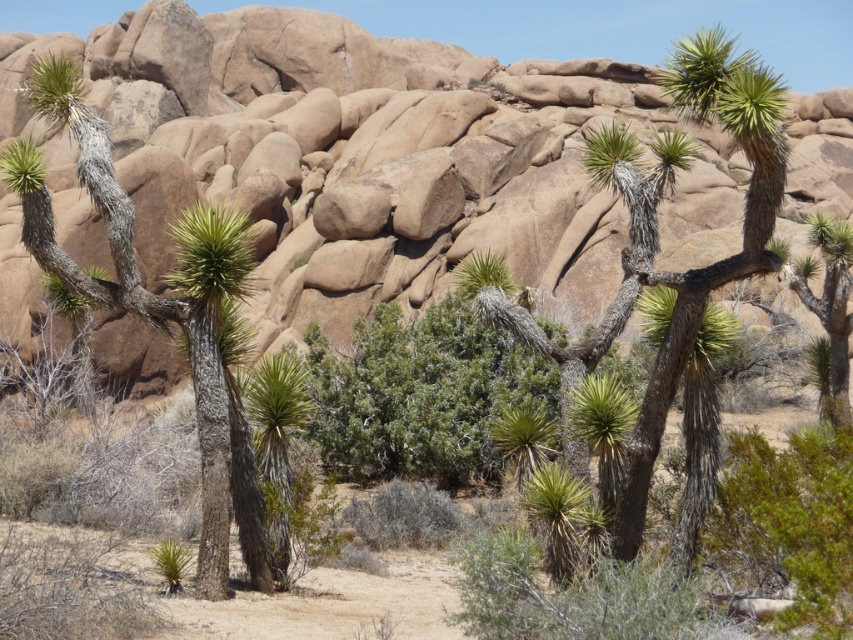
Question: Is gray bark tree at center in front of green spiky plant at center?

Choices:
 (A) yes
 (B) no

Answer: (B)

Question: Which point is farther from the camera taking this photo?

Choices:
 (A) (592, 140)
 (B) (76, 276)

Answer: (A)

Question: Can you confirm if gray bark tree at center is wider than green spiky plant at center?

Choices:
 (A) no
 (B) yes

Answer: (A)

Question: Can you confirm if gray bark tree at center is bigger than green spiky plant at center?

Choices:
 (A) no
 (B) yes

Answer: (A)